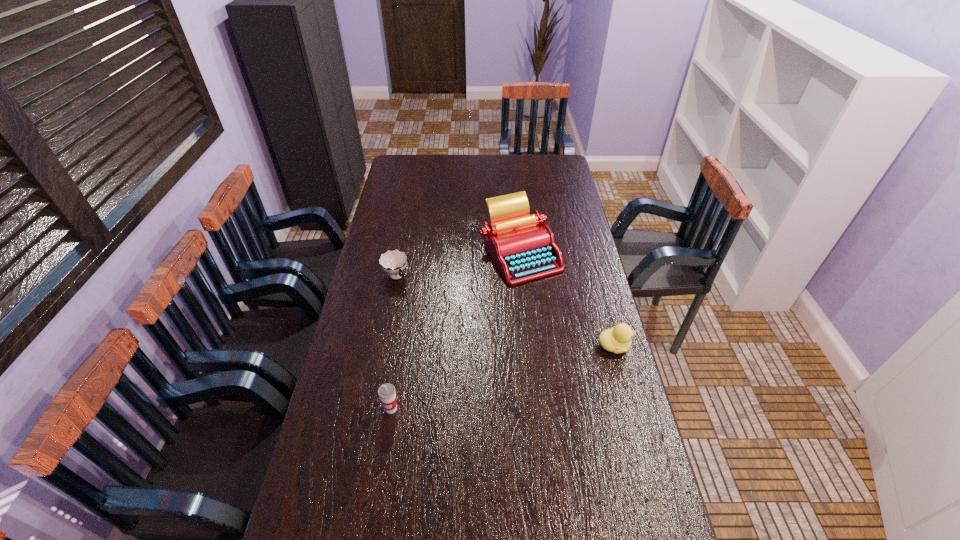
Where is `free location located on the side of the farther cup with the handle`? The width and height of the screenshot is (960, 540). free location located on the side of the farther cup with the handle is located at coordinates pyautogui.click(x=433, y=321).

This screenshot has height=540, width=960. I want to click on free space located on the typing side of the tallest object, so click(x=508, y=362).

Image resolution: width=960 pixels, height=540 pixels. Find the location of `free space located 0.300m on the typing side of the tallest object`. free space located 0.300m on the typing side of the tallest object is located at coordinates (510, 350).

At what (x,y) coordinates should I click in order to perform the action: click on vacant space located on the typing side of the tallest object. Please return your answer as a coordinate pair (x, y). Looking at the image, I should click on (513, 322).

The width and height of the screenshot is (960, 540). What are the coordinates of `object that is at the left edge` in the screenshot? It's located at (393, 262).

Find the location of a particular element. duckling at the right edge is located at coordinates [x=618, y=339].

The width and height of the screenshot is (960, 540). I want to click on typewriter that is at the right edge, so click(x=522, y=246).

I want to click on free space at the far edge, so click(x=501, y=160).

You are a GUI agent. You are given a task and a screenshot of the screen. Output one action in this format:
    pyautogui.click(x=<x>, y=<y>)
    Task: Click on the free space at the near edge
    The image size is (960, 540).
    Given the screenshot: What is the action you would take?
    pyautogui.click(x=471, y=512)

Identify the location of blank space at the left edge. Image resolution: width=960 pixels, height=540 pixels. (410, 230).